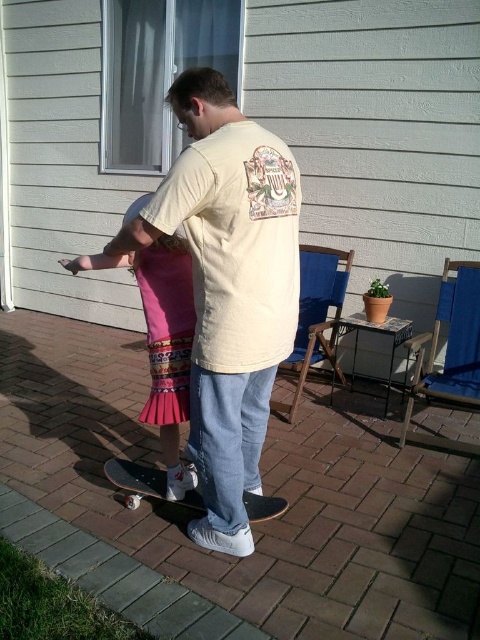
Question: Which point is farther to the camera?

Choices:
 (A) brick pavement at center
 (B) black matte skateboard at center

Answer: (B)

Question: Is pink pleated skirt at center positioned in front of black matte skateboard at center?

Choices:
 (A) yes
 (B) no

Answer: (A)

Question: Estimate the real-world distances between objects in this image. Which object is farther from the pink pleated skirt at center?

Choices:
 (A) brick pavement at center
 (B) black matte skateboard at center

Answer: (A)

Question: Does brick pavement at center appear under black matte skateboard at center?

Choices:
 (A) no
 (B) yes

Answer: (A)

Question: Does brick pavement at center have a greater width compared to pink pleated skirt at center?

Choices:
 (A) no
 (B) yes

Answer: (B)

Question: Considering the real-world distances, which object is closest to the brick pavement at center?

Choices:
 (A) black matte skateboard at center
 (B) pink pleated skirt at center

Answer: (A)